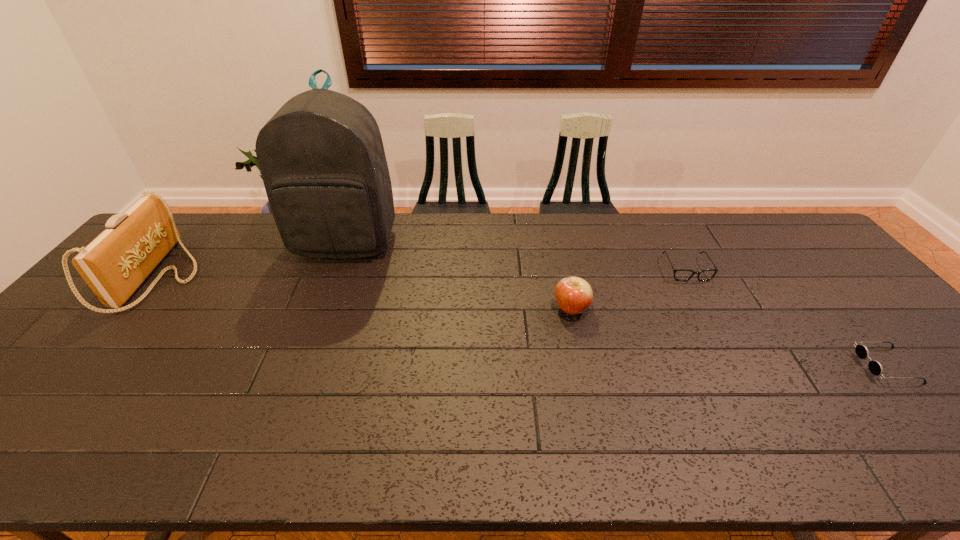
Identify the location of object present at the far left corner. (114, 265).

In the image, there is a desktop. At what (x,y) coordinates should I click in order to perform the action: click on free space at the far edge. Please return your answer as a coordinate pair (x, y). Image resolution: width=960 pixels, height=540 pixels. Looking at the image, I should click on (480, 230).

This screenshot has height=540, width=960. Identify the location of free space at the near edge of the desktop. 807,435.

The height and width of the screenshot is (540, 960). In order to click on vacant space at the right edge of the desktop in this screenshot , I will do `click(943, 400)`.

The image size is (960, 540). In the image, there is a desktop. Find the location of `vacant space at the far right corner`. vacant space at the far right corner is located at coordinates (804, 249).

Locate an element on the screen. The image size is (960, 540). free space at the near right corner of the desktop is located at coordinates (942, 444).

Find the location of a particular element. The image size is (960, 540). free space between the spectacles and the apple is located at coordinates (629, 289).

Identify the location of vacant space that is in between the handbag and the sunglasses. (523, 321).

The height and width of the screenshot is (540, 960). Identify the location of vacant region between the fourth shortest object and the shortest object. (523, 321).

Identify the location of empty space between the second object from right to left and the apple. (629, 289).